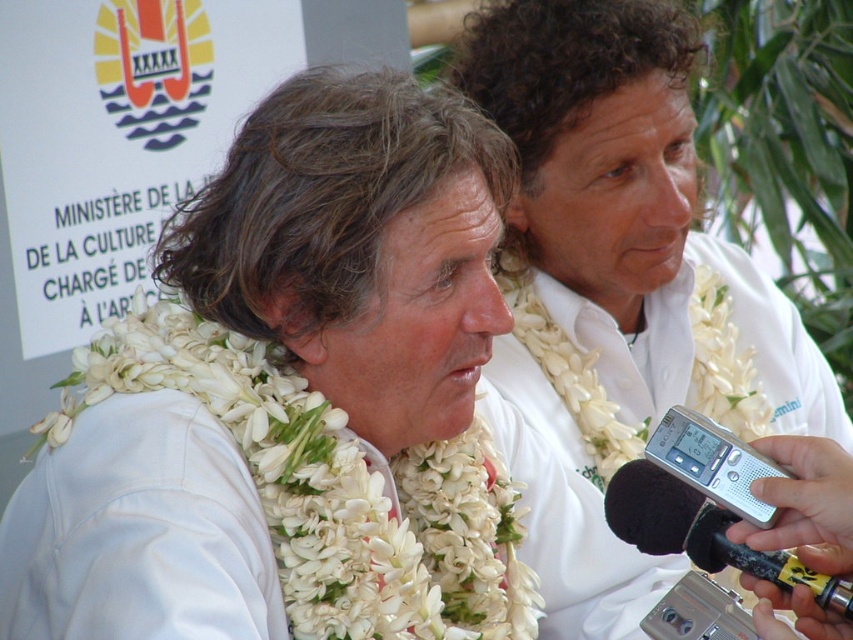
Between white fabric shirt at upper center and black foam microphone at lower right, which one is positioned lower?

black foam microphone at lower right is below.

Is white fabric shirt at upper center closer to camera compared to black foam microphone at lower right?

No, white fabric shirt at upper center is behind black foam microphone at lower right.

Is point (598, 115) closer to camera compared to point (730, 512)?

No, it is behind (730, 512).

Identify the location of white fabric shirt at upper center. The height and width of the screenshot is (640, 853). (627, 204).

Does point (300, 236) lie behind point (640, 468)?

Yes, point (300, 236) is behind point (640, 468).

You are a GUI agent. You are given a task and a screenshot of the screen. Output one action in this format:
    pyautogui.click(x=<x>, y=<y>)
    Task: Click on the white fabric lei at center
    The height and width of the screenshot is (640, 853).
    Given the screenshot: What is the action you would take?
    293,397

Can you confirm if white fabric lei at center is bigger than silver metallic video camera at lower center?

Yes, white fabric lei at center is bigger than silver metallic video camera at lower center.

Which is in front, point (460, 173) or point (660, 621)?

Point (660, 621)

Identify the location of white fabric lei at center. The height and width of the screenshot is (640, 853). (293, 397).